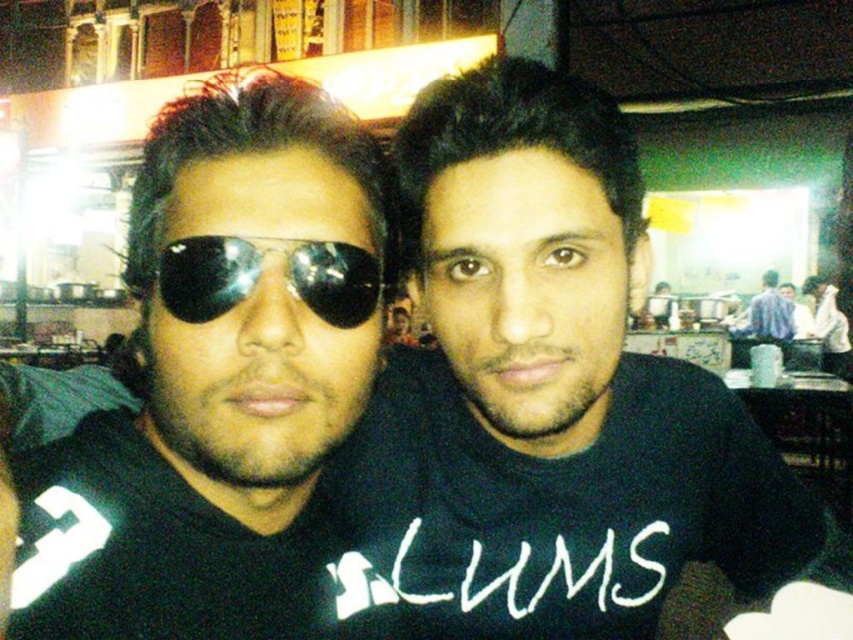
Question: Can you confirm if black matte shirt at center is positioned to the right of blue shirt at right?

Choices:
 (A) yes
 (B) no

Answer: (B)

Question: Is matte black sunglasses at left to the left of shiny black goggles at center from the viewer's perspective?

Choices:
 (A) yes
 (B) no

Answer: (A)

Question: Among these objects, which one is farthest from the camera?

Choices:
 (A) black matte shirt at center
 (B) matte black sunglasses at left
 (C) blue shirt at right

Answer: (C)

Question: Observing the image, what is the correct spatial positioning of matte black sunglasses at left in reference to shiny black goggles at center?

Choices:
 (A) left
 (B) right

Answer: (A)

Question: Which of the following is the closest to the observer?

Choices:
 (A) (358, 211)
 (B) (770, 312)
 (C) (181, 296)

Answer: (C)

Question: Based on their relative distances, which object is farther from the matte black sunglasses at left?

Choices:
 (A) black matte shirt at center
 (B) shiny black goggles at center
 (C) blue shirt at right

Answer: (C)